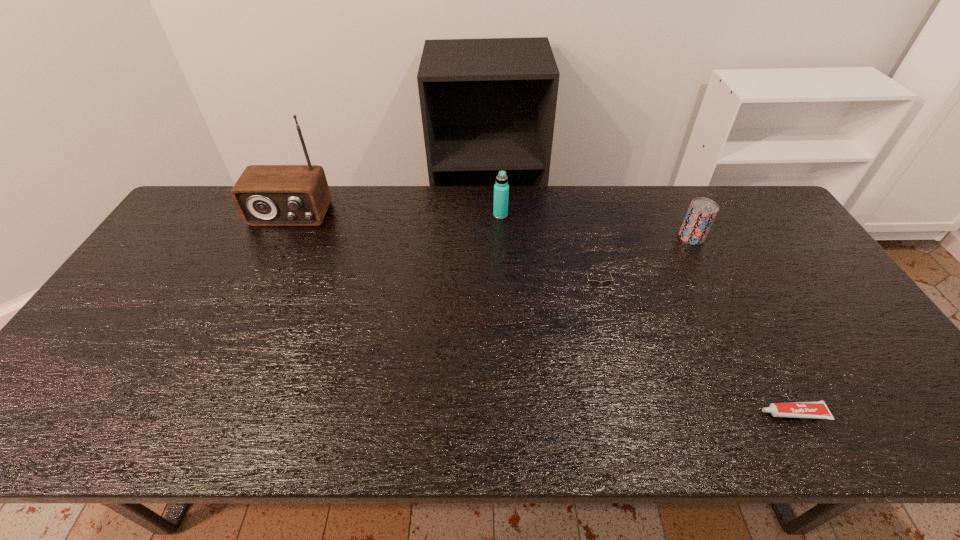
Identify the location of vacant space that's between the second nearest object and the beer can. (643, 262).

What are the coordinates of `free space between the second nearest object and the toothpaste` in the screenshot? It's located at (694, 351).

Image resolution: width=960 pixels, height=540 pixels. I want to click on free space between the fourth farthest object and the fourth shortest object, so click(548, 252).

Find the location of a particular element. free spot between the shortest object and the second tallest object is located at coordinates (647, 314).

I want to click on vacant region between the fourth tallest object and the tallest object, so click(x=443, y=251).

Locate an element on the screen. The image size is (960, 540). vacant point located between the second nearest object and the leftmost object is located at coordinates (443, 251).

Where is `vacant area between the fourth object from right to left and the second nearest object`? vacant area between the fourth object from right to left and the second nearest object is located at coordinates [548, 252].

Point out which object is positioned as the third nearest to the beer can. Please provide its 2D coordinates. Your answer should be formatted as a tuple, i.e. [(x, y)], where the tuple contains the x and y coordinates of a point satisfying the conditions above.

[(501, 189)]

Locate which object is the second closest to the sunglasses. Please provide its 2D coordinates. Your answer should be formatted as a tuple, i.e. [(x, y)], where the tuple contains the x and y coordinates of a point satisfying the conditions above.

[(501, 189)]

Where is `free space that satisfies the following two spatial constraints: 1. on the front-facing side of the leftmost object; 2. on the left side of the third tallest object`? Image resolution: width=960 pixels, height=540 pixels. free space that satisfies the following two spatial constraints: 1. on the front-facing side of the leftmost object; 2. on the left side of the third tallest object is located at coordinates (279, 237).